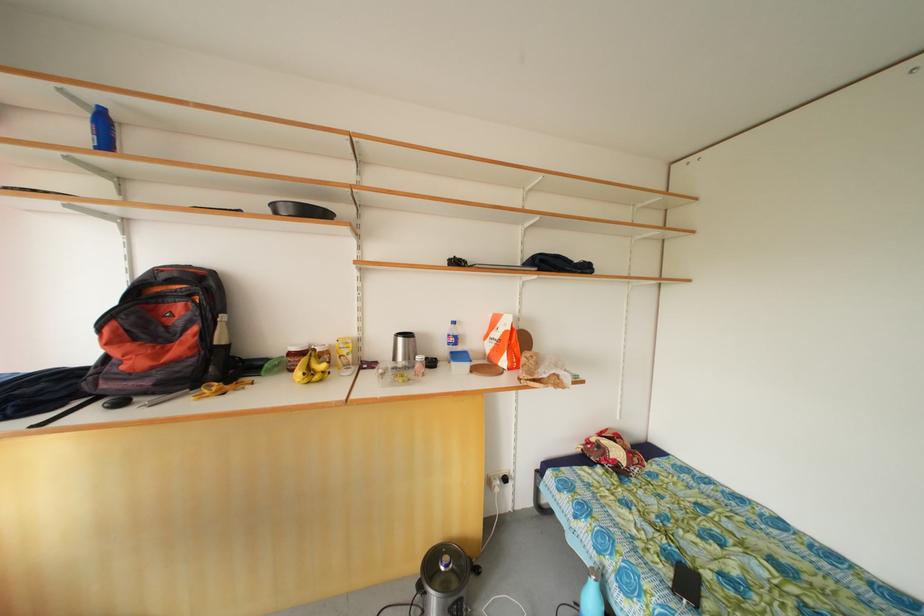
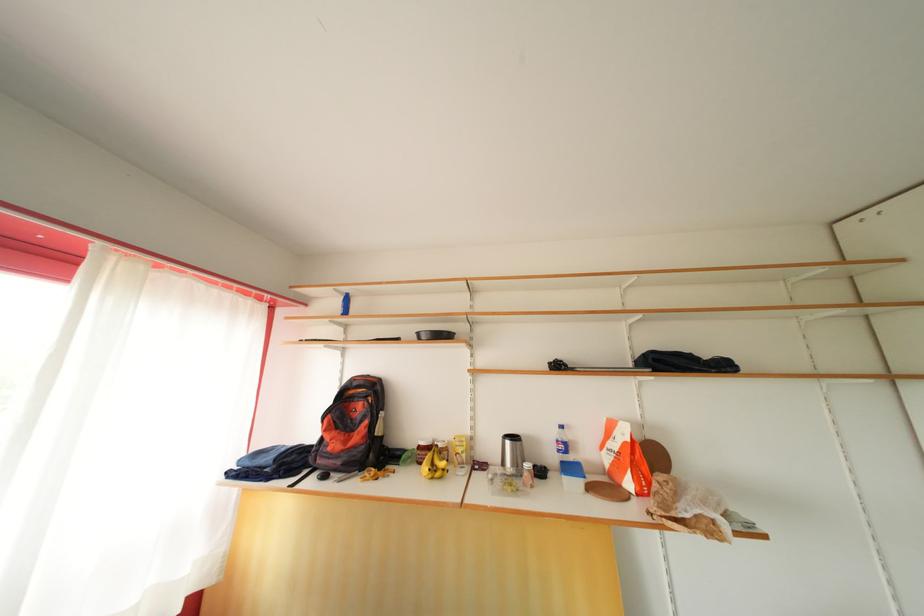
Find the pixel in the second image that matches pixel 407 345 in the first image.

(515, 448)